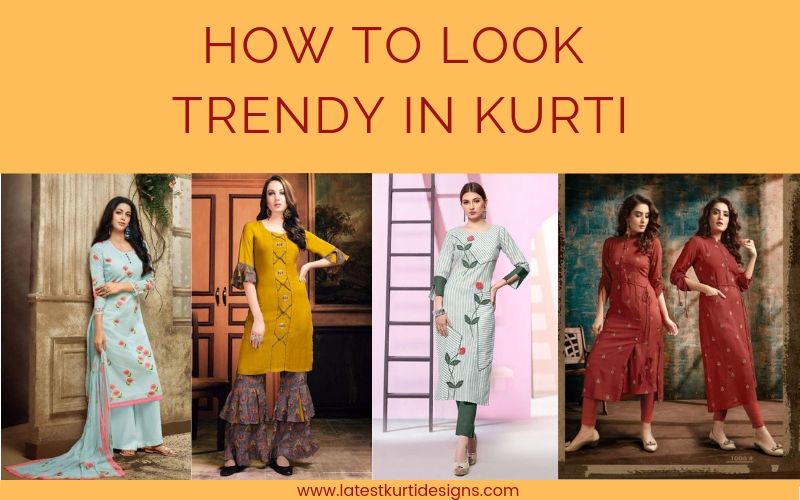
This screenshot has width=800, height=500. Identify the location of ladder. (410, 253).